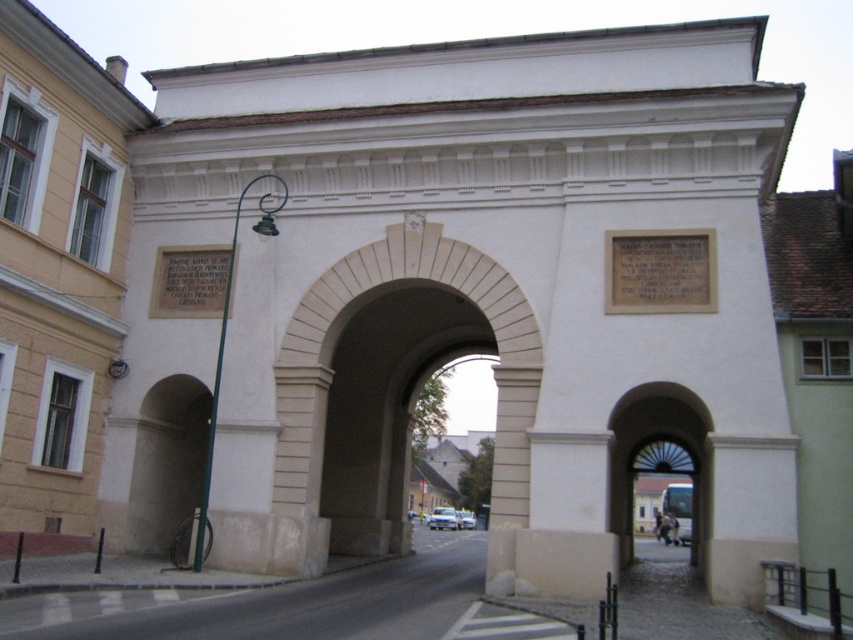
You are a visitor approaching the entrance of the historic site. You see the white stone archway at center and the matte glass door at center. Which object is positioned higher up in the image?

The white stone archway at center is above the matte glass door at center, so it is positioned higher up in the image.

You are a painter who wants to paint the white stone archway at center and the matte glass door at center. Which object requires more paint because it has a larger surface area?

The matte glass door at center requires more paint because it is thicker than the white stone archway at center.